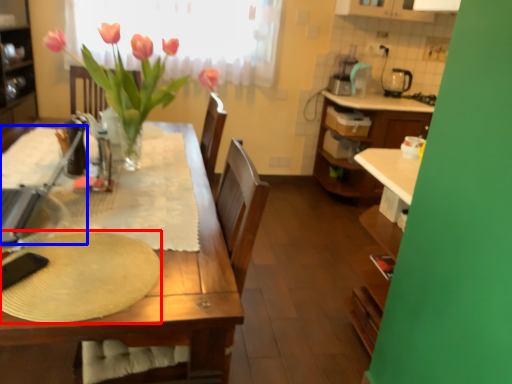
Question: Which of the following is the farthest to the observer, paper plate (highlighted by a red box) or appliance (highlighted by a blue box)?

Choices:
 (A) paper plate
 (B) appliance

Answer: (B)